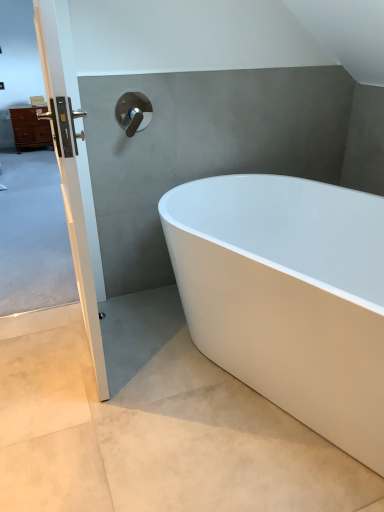
You are a GUI agent. You are given a task and a screenshot of the screen. Output one action in this format:
    pyautogui.click(x=<x>, y=<y>)
    Task: Click on the vacant space to the left of white glossy door handle at left
    
    Given the screenshot: What is the action you would take?
    pyautogui.click(x=43, y=345)